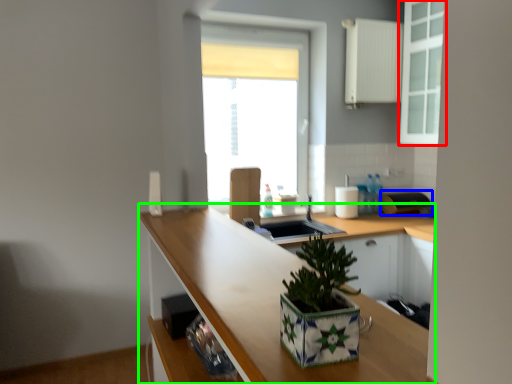
Question: Which is farther away from cabinetry (highlighted by a red box)? appliance (highlighted by a blue box) or countertop (highlighted by a green box)?

Choices:
 (A) appliance
 (B) countertop

Answer: (B)